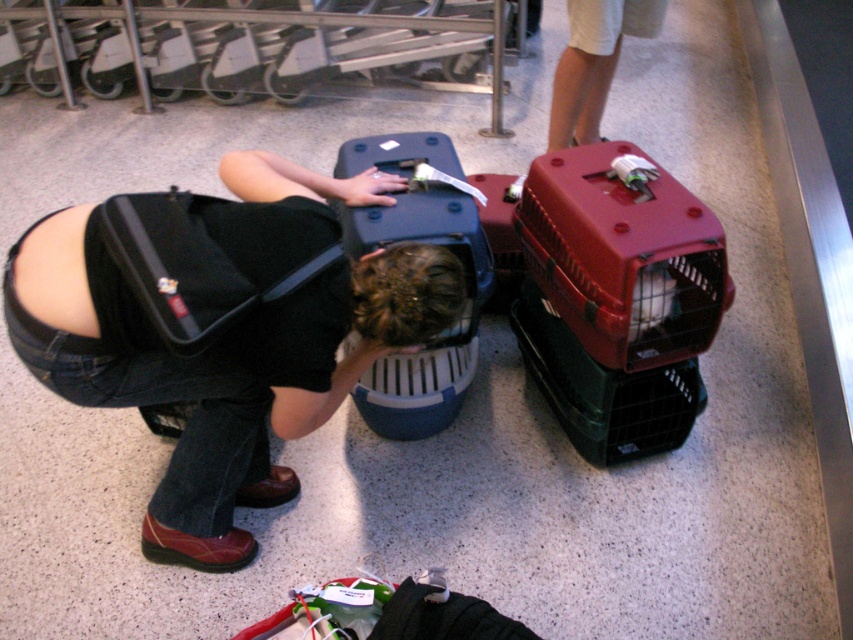
Does black matte suitcase at center come behind translucent plastic pet carrier at center?

No, black matte suitcase at center is in front of translucent plastic pet carrier at center.

Can you confirm if black matte suitcase at center is positioned above translucent plastic pet carrier at center?

No, black matte suitcase at center is not above translucent plastic pet carrier at center.

Which is in front, point (462, 308) or point (340, 150)?

Point (462, 308) is more forward.

Locate an element on the screen. black matte suitcase at center is located at coordinates (221, 326).

From the picture: Who is positioned more to the left, translucent plastic pet carrier at center or white cotton shorts at upper center?

Positioned to the left is translucent plastic pet carrier at center.

Can you confirm if translucent plastic pet carrier at center is positioned below white cotton shorts at upper center?

Correct, translucent plastic pet carrier at center is located below white cotton shorts at upper center.

Does point (415, 195) come closer to viewer compared to point (612, 49)?

Yes, point (415, 195) is in front of point (612, 49).

Where is `translucent plastic pet carrier at center`? translucent plastic pet carrier at center is located at coordinates (428, 241).

Does black matte suitcase at center have a smaller size compared to white cotton shorts at upper center?

Incorrect, black matte suitcase at center is not smaller in size than white cotton shorts at upper center.

Is black matte suitcase at center positioned in front of white cotton shorts at upper center?

Yes.

Does point (415, 273) lie in front of point (651, 22)?

That is True.

Where is `black matte suitcase at center`? Image resolution: width=853 pixels, height=640 pixels. black matte suitcase at center is located at coordinates (221, 326).